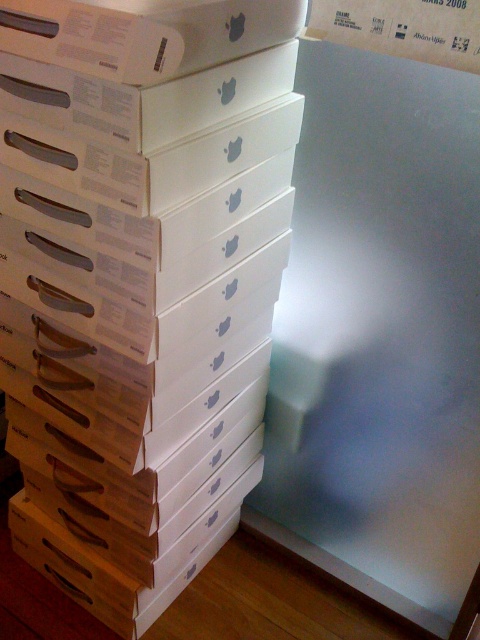
Question: Which object appears closest to the camera in this image?

Choices:
 (A) white cardboard box at upper center
 (B) white cardboard boxes at center

Answer: (B)

Question: From the image, what is the correct spatial relationship of white cardboard boxes at center in relation to white cardboard box at upper center?

Choices:
 (A) left
 (B) right

Answer: (A)

Question: Can you confirm if white cardboard boxes at center is positioned below white cardboard box at upper center?

Choices:
 (A) no
 (B) yes

Answer: (B)

Question: Is white cardboard boxes at center smaller than white cardboard box at upper center?

Choices:
 (A) yes
 (B) no

Answer: (B)

Question: Which object is farther from the camera taking this photo?

Choices:
 (A) white cardboard boxes at center
 (B) white cardboard box at upper center

Answer: (B)

Question: Which of the following is the closest to the observer?

Choices:
 (A) (460, 61)
 (B) (153, 560)

Answer: (A)